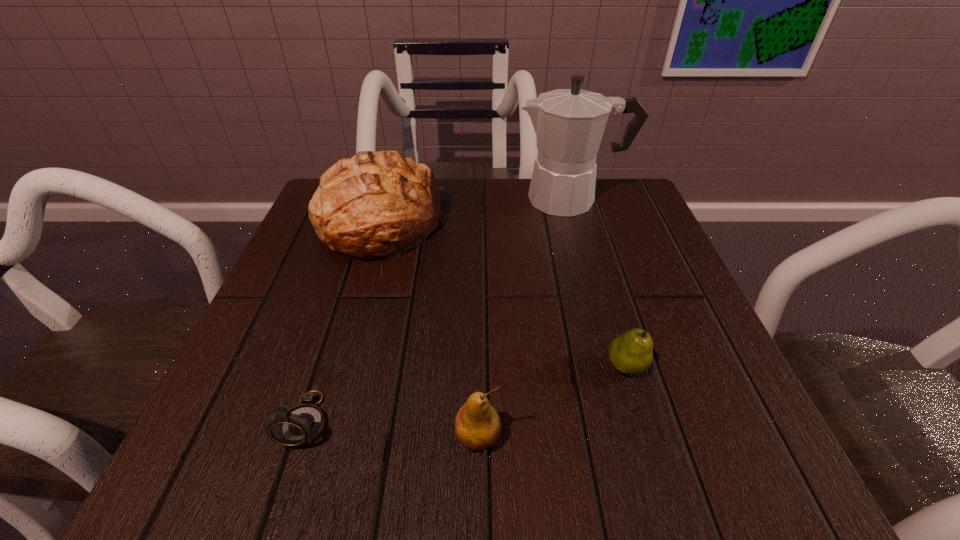
Identify which object is the second nearest to the tallest object. Please provide its 2D coordinates. Your answer should be formatted as a tuple, i.e. [(x, y)], where the tuple contains the x and y coordinates of a point satisfying the conditions above.

[(631, 353)]

Identify which object is the closest to the nearer pear. Please provide its 2D coordinates. Your answer should be formatted as a tuple, i.e. [(x, y)], where the tuple contains the x and y coordinates of a point satisfying the conditions above.

[(631, 353)]

Identify the location of vacant area in the image that satisfies the following two spatial constraints: 1. at the spout of the coffeepot; 2. on the back side of the farther pear. Image resolution: width=960 pixels, height=540 pixels. (618, 366).

At what (x,y) coordinates should I click in order to perform the action: click on vacant space that satisfies the following two spatial constraints: 1. on the back side of the shorter pear; 2. at the spout of the coffeepot. Please return your answer as a coordinate pair (x, y). The width and height of the screenshot is (960, 540). Looking at the image, I should click on (576, 199).

At what (x,y) coordinates should I click in order to perform the action: click on free space that satisfies the following two spatial constraints: 1. on the front side of the nearer pear; 2. on the left side of the fourth shortest object. Please return your answer as a coordinate pair (x, y). This screenshot has height=540, width=960. Looking at the image, I should click on (318, 437).